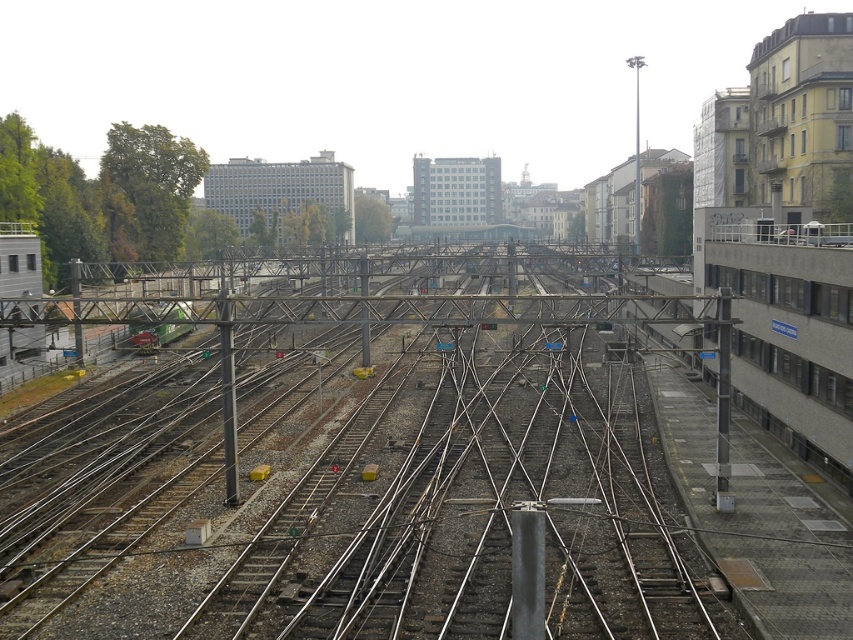
Question: Which point appears closest to the camera in this image?

Choices:
 (A) (90, 444)
 (B) (172, 339)

Answer: (A)

Question: Can you confirm if metal at center is smaller than green matte train at center?

Choices:
 (A) yes
 (B) no

Answer: (B)

Question: Can you confirm if metal at center is positioned below green matte train at center?

Choices:
 (A) no
 (B) yes

Answer: (B)

Question: Is metal at center below green matte train at center?

Choices:
 (A) yes
 (B) no

Answer: (A)